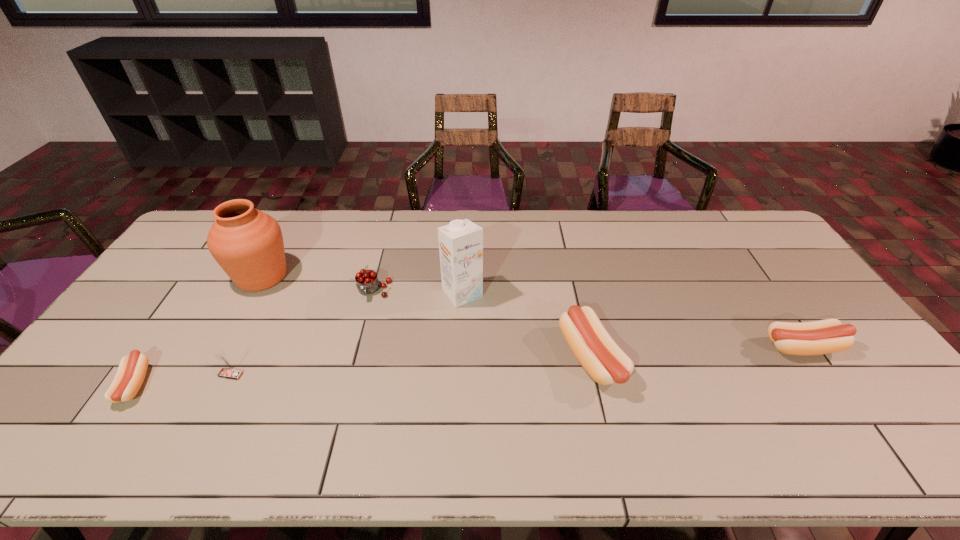
To achieve uniform spacing by inserting another sausage among them, please point to a free space for this new sausage. Please provide its 2D coordinates. Your answer should be formatted as a tuple, i.e. [(x, y)], where the tuple contains the x and y coordinates of a point satisfying the conditions above.

[(369, 371)]